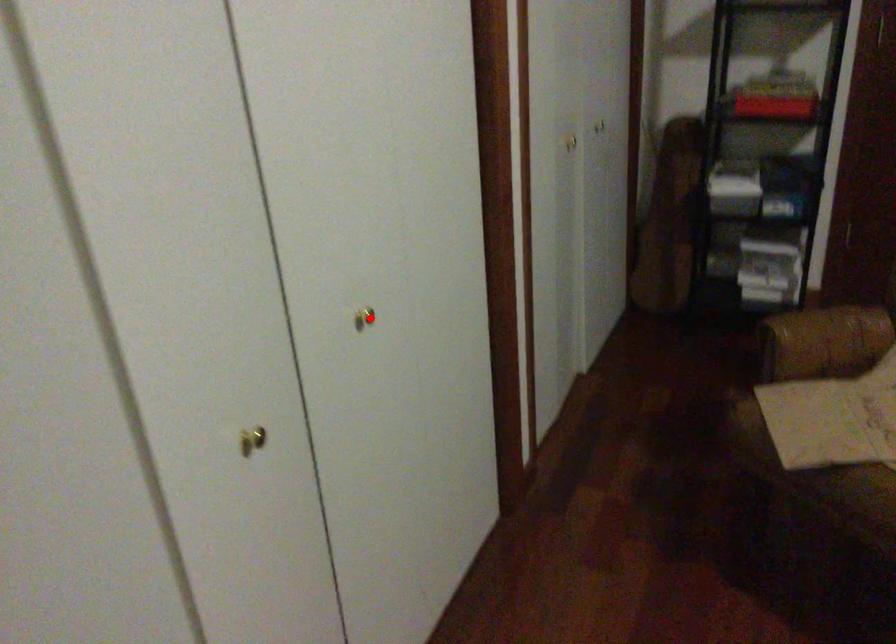
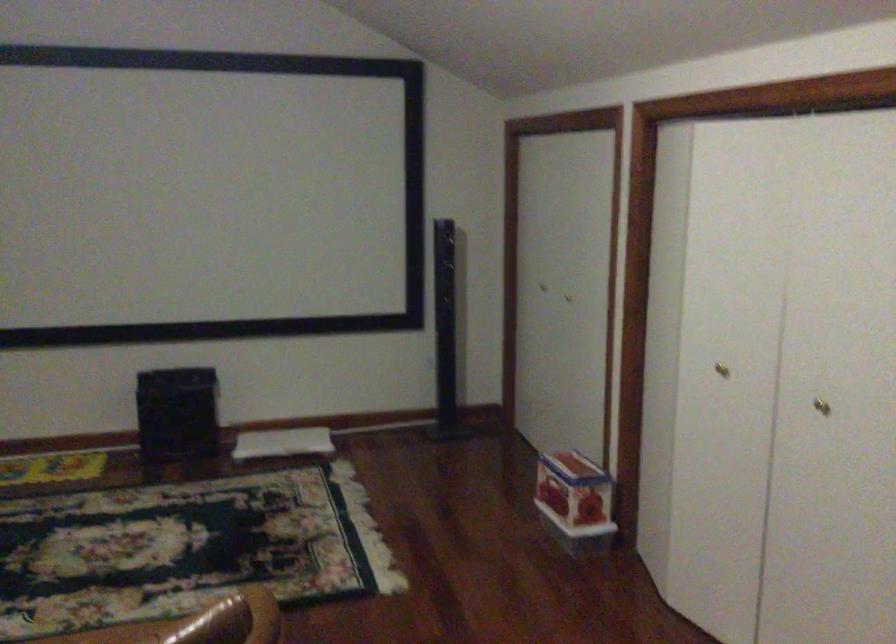
Find the pixel in the second image that matches the highlighted location in the first image.

(821, 406)